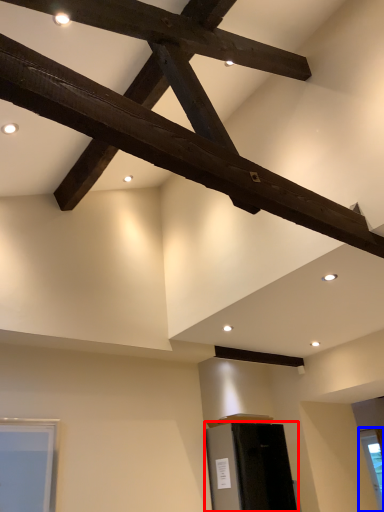
Question: Among these objects, which one is nearest to the camera, furniture (highlighted by a red box) or window (highlighted by a blue box)?

Choices:
 (A) furniture
 (B) window

Answer: (A)